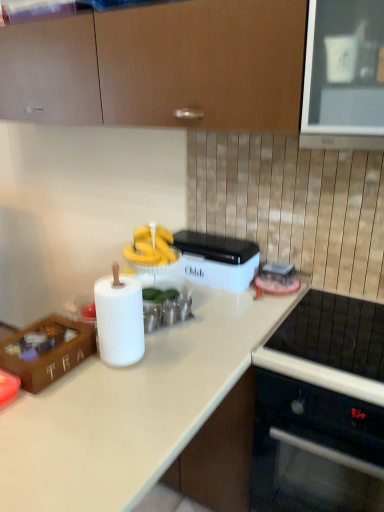
Question: In the image, is wooden tea box at lower left on the left side or the right side of white matte countertop at center?

Choices:
 (A) right
 (B) left

Answer: (B)

Question: From the image's perspective, is wooden tea box at lower left positioned above or below white matte countertop at center?

Choices:
 (A) below
 (B) above

Answer: (B)

Question: Considering the real-world distances, which object is closest to the wooden tea box at lower left?

Choices:
 (A) black glass cooktop at lower right
 (B) matte wood cabinets at upper center
 (C) white plastic container at center
 (D) white matte countertop at center

Answer: (D)

Question: Which of these objects is positioned farthest from the wooden tea box at lower left?

Choices:
 (A) matte wood cabinets at upper center
 (B) white plastic container at center
 (C) black glass cooktop at lower right
 (D) white matte countertop at center

Answer: (A)